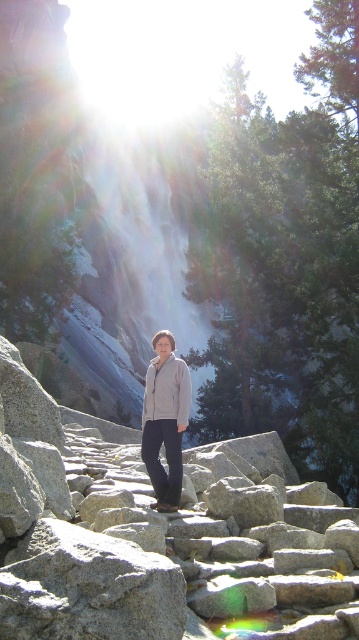
Question: Is light gray fleece jacket at center bigger than light gray fleece sweatshirt at center?

Choices:
 (A) no
 (B) yes

Answer: (B)

Question: Which of the following is the farthest from the observer?

Choices:
 (A) light gray fleece jacket at center
 (B) smooth granite rocks at center

Answer: (A)

Question: Which point is closer to the camera?

Choices:
 (A) (179, 531)
 (B) (166, 352)
 (C) (156, 387)

Answer: (A)

Question: From the image, what is the correct spatial relationship of smooth granite rocks at center in relation to light gray fleece sweatshirt at center?

Choices:
 (A) below
 (B) above

Answer: (A)

Question: Estimate the real-world distances between objects in this image. Which object is closer to the smooth granite rocks at center?

Choices:
 (A) light gray fleece jacket at center
 (B) light gray fleece sweatshirt at center

Answer: (A)

Question: Does smooth granite rocks at center appear under light gray fleece sweatshirt at center?

Choices:
 (A) yes
 (B) no

Answer: (A)